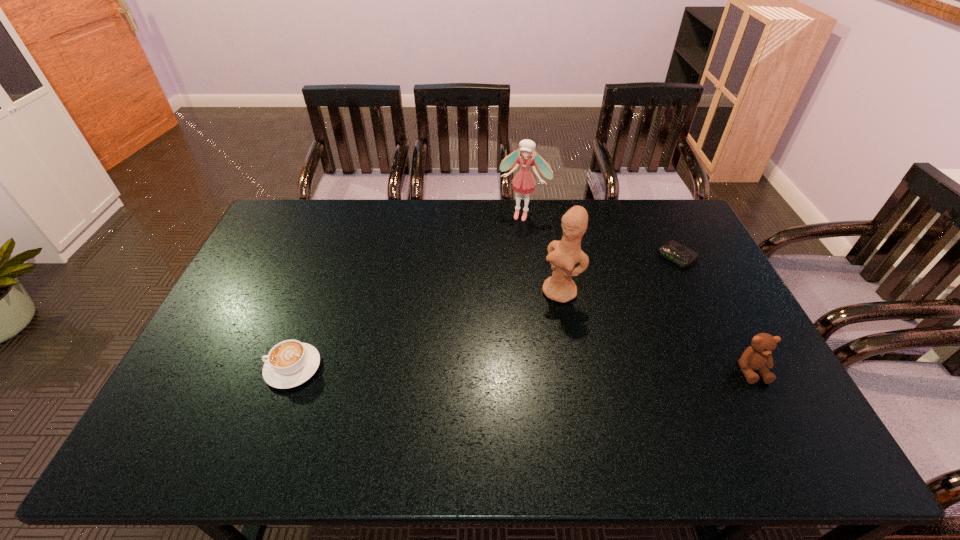
The image size is (960, 540). I want to click on the leftmost object, so click(290, 363).

Locate an element on the screen. The image size is (960, 540). the fourth tallest object is located at coordinates (290, 363).

At what (x,y) coordinates should I click in order to perform the action: click on teddy bear. Please return your answer as a coordinate pair (x, y). This screenshot has height=540, width=960. Looking at the image, I should click on (757, 357).

Image resolution: width=960 pixels, height=540 pixels. I want to click on the shortest object, so click(x=682, y=256).

Identify the location of alarm clock. (682, 256).

Find the location of a particular element. The width and height of the screenshot is (960, 540). the farthest object is located at coordinates (523, 182).

Where is `the third farthest object`? The width and height of the screenshot is (960, 540). the third farthest object is located at coordinates (563, 255).

The image size is (960, 540). In order to click on vacant space situated on the side of the fourth tallest object with the handle in this screenshot , I will do `click(190, 368)`.

Image resolution: width=960 pixels, height=540 pixels. I want to click on vacant space located on the side of the fourth tallest object with the handle, so click(202, 368).

Image resolution: width=960 pixels, height=540 pixels. In order to click on vacant position located on the side of the fourth tallest object with the handle in this screenshot , I will do `click(247, 368)`.